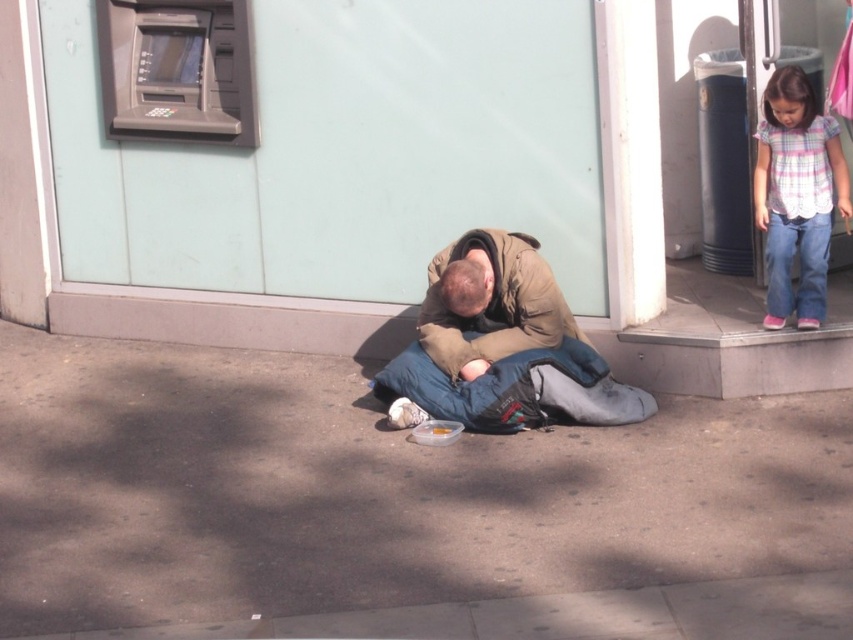
You are a delivery person who needs to place a package on the brown concrete pavement at center. However, there is a brown fuzzy jacket at center in the way. Can you place the package on the pavement without moving the jacket?

The brown concrete pavement at center is much taller than the brown fuzzy jacket at center, so you can place the package on the pavement without needing to move the jacket since the pavement is elevated above the jacket.

You are a delivery person who needs to place a package on the brown concrete pavement at center. However, there is a blue fabric sleeping bag at center in the way. Can you place the package directly on the pavement without moving the sleeping bag?

The brown concrete pavement at center is located below the blue fabric sleeping bag at center, so you cannot place the package directly on the pavement without moving the sleeping bag.

You are a delivery person who needs to place a package on the largest available surface in the scene. Which object should you choose between the brown concrete pavement at center and the brown fuzzy jacket at center?

The brown concrete pavement at center is larger in size than the brown fuzzy jacket at center, so you should choose the brown concrete pavement at center to place the package.